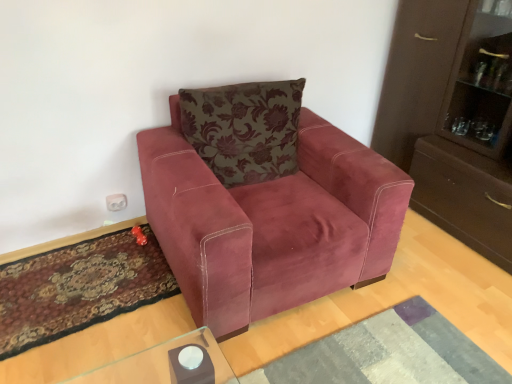
Where is `carpeted rug at lower left, which ranks as the first mat in left-to-right order`? This screenshot has width=512, height=384. carpeted rug at lower left, which ranks as the first mat in left-to-right order is located at coordinates (79, 288).

Where is `chair in front of the velvet floral pillow at center`? Image resolution: width=512 pixels, height=384 pixels. chair in front of the velvet floral pillow at center is located at coordinates (265, 203).

Which object is further away from the camera taking this photo, velvet pink armchair at center or velvet floral pillow at center?

velvet floral pillow at center is more distant.

In terms of width, does velvet pink armchair at center look wider or thinner when compared to velvet floral pillow at center?

velvet pink armchair at center is wider than velvet floral pillow at center.

From a real-world perspective, which object rests below the other?

From a 3D spatial view, velvet pink armchair at center is below.

From the image's perspective, would you say textured gray mat at lower center, which is counted as the first mat, starting from the right, is shown under carpeted rug at lower left, which ranks as the first mat in left-to-right order?

Indeed, from the image's perspective, textured gray mat at lower center, which is counted as the first mat, starting from the right, is shown beneath carpeted rug at lower left, which ranks as the first mat in left-to-right order.

Which object is positioned more to the right, textured gray mat at lower center, which is counted as the first mat, starting from the right, or carpeted rug at lower left, the 2th mat from the right?

Positioned to the right is textured gray mat at lower center, which is counted as the first mat, starting from the right.

Is carpeted rug at lower left, which ranks as the first mat in left-to-right order, at the back of textured gray mat at lower center, which is counted as the first mat, starting from the right?

No, textured gray mat at lower center, which is counted as the first mat, starting from the right, is not facing away from carpeted rug at lower left, which ranks as the first mat in left-to-right order.

Which is in front, point (227, 151) or point (372, 376)?

The point (372, 376) is closer to the camera.

Where is `mat on the right of velvet floral pillow at center`? Image resolution: width=512 pixels, height=384 pixels. mat on the right of velvet floral pillow at center is located at coordinates (388, 353).

Is velvet floral pillow at center facing away from textured gray mat at lower center, placed as the second mat when sorted from left to right?

velvet floral pillow at center does not have its back to textured gray mat at lower center, placed as the second mat when sorted from left to right.

Is point (156, 239) positioned before point (259, 369)?

No, it is behind (259, 369).

From the picture: From the image's perspective, is carpeted rug at lower left, which ranks as the first mat in left-to-right order, below textured gray mat at lower center, which is counted as the first mat, starting from the right?

No, from the image's perspective, carpeted rug at lower left, which ranks as the first mat in left-to-right order, is not beneath textured gray mat at lower center, which is counted as the first mat, starting from the right.

Is carpeted rug at lower left, which ranks as the first mat in left-to-right order, not within textured gray mat at lower center, which is counted as the first mat, starting from the right?

Absolutely, carpeted rug at lower left, which ranks as the first mat in left-to-right order, is external to textured gray mat at lower center, which is counted as the first mat, starting from the right.

Consider the image. Between carpeted rug at lower left, the 2th mat from the right, and textured gray mat at lower center, placed as the second mat when sorted from left to right, which one appears on the right side from the viewer's perspective?

textured gray mat at lower center, placed as the second mat when sorted from left to right.

Is carpeted rug at lower left, which ranks as the first mat in left-to-right order, positioned far away from velvet pink armchair at center?

No, carpeted rug at lower left, which ranks as the first mat in left-to-right order, is not far away from velvet pink armchair at center.

In the scene shown: Considering the relative sizes of carpeted rug at lower left, which ranks as the first mat in left-to-right order, and velvet pink armchair at center in the image provided, is carpeted rug at lower left, which ranks as the first mat in left-to-right order, bigger than velvet pink armchair at center?

Incorrect, carpeted rug at lower left, which ranks as the first mat in left-to-right order, is not larger than velvet pink armchair at center.

Is carpeted rug at lower left, which ranks as the first mat in left-to-right order, in front of or behind velvet pink armchair at center in the image?

carpeted rug at lower left, which ranks as the first mat in left-to-right order, is positioned farther from the viewer than velvet pink armchair at center.

Find the location of a particular element. Image resolution: width=512 pixels, height=384 pixels. mat behind the velvet pink armchair at center is located at coordinates (79, 288).

From a real-world perspective, is velvet pink armchair at center located higher than carpeted rug at lower left, which ranks as the first mat in left-to-right order?

Yes, from a real-world perspective, velvet pink armchair at center is on top of carpeted rug at lower left, which ranks as the first mat in left-to-right order.

Does velvet pink armchair at center lie in front of carpeted rug at lower left, which ranks as the first mat in left-to-right order?

Yes, it is.

From the image's perspective, is velvet pink armchair at center located above or below carpeted rug at lower left, the 2th mat from the right?

Clearly, from the image's perspective, velvet pink armchair at center is above carpeted rug at lower left, the 2th mat from the right.

Considering the points (389, 321) and (277, 125), which point is in front, point (389, 321) or point (277, 125)?

Point (389, 321)

Is textured gray mat at lower center, which is counted as the first mat, starting from the right, in front of or behind velvet floral pillow at center in the image?

textured gray mat at lower center, which is counted as the first mat, starting from the right, is positioned closer to the viewer than velvet floral pillow at center.

From a real-world perspective, which is physically below, textured gray mat at lower center, placed as the second mat when sorted from left to right, or velvet floral pillow at center?

textured gray mat at lower center, placed as the second mat when sorted from left to right.

Consider the image. From the image's perspective, would you say textured gray mat at lower center, which is counted as the first mat, starting from the right, is shown under velvet floral pillow at center?

Yes, from the image's perspective, textured gray mat at lower center, which is counted as the first mat, starting from the right, is below velvet floral pillow at center.

Where is `pillow on the left side of velvet pink armchair at center`? This screenshot has width=512, height=384. pillow on the left side of velvet pink armchair at center is located at coordinates (244, 129).

Find the location of a particular element. This screenshot has height=384, width=512. mat that appears above the textured gray mat at lower center, which is counted as the first mat, starting from the right (from the image's perspective) is located at coordinates (79, 288).

When comparing their distances from velvet floral pillow at center, does velvet pink armchair at center or textured gray mat at lower center, placed as the second mat when sorted from left to right, seem closer?

Among the two, velvet pink armchair at center is located nearer to velvet floral pillow at center.

From the image, which object appears to be nearer to textured gray mat at lower center, which is counted as the first mat, starting from the right, velvet floral pillow at center or velvet pink armchair at center?

velvet pink armchair at center is closer to textured gray mat at lower center, which is counted as the first mat, starting from the right.

When comparing their distances from carpeted rug at lower left, which ranks as the first mat in left-to-right order, does velvet floral pillow at center or velvet pink armchair at center seem closer?

velvet pink armchair at center is closer to carpeted rug at lower left, which ranks as the first mat in left-to-right order.

Looking at the image, which one is located closer to velvet floral pillow at center, textured gray mat at lower center, placed as the second mat when sorted from left to right, or velvet pink armchair at center?

The object closer to velvet floral pillow at center is velvet pink armchair at center.

When comparing their distances from velvet pink armchair at center, does textured gray mat at lower center, placed as the second mat when sorted from left to right, or carpeted rug at lower left, the 2th mat from the right, seem closer?

textured gray mat at lower center, placed as the second mat when sorted from left to right, is positioned closer to the anchor velvet pink armchair at center.

In the scene shown: From the image, which object appears to be nearer to textured gray mat at lower center, placed as the second mat when sorted from left to right, velvet floral pillow at center or carpeted rug at lower left, which ranks as the first mat in left-to-right order?

carpeted rug at lower left, which ranks as the first mat in left-to-right order.

Based on their spatial positions, is textured gray mat at lower center, placed as the second mat when sorted from left to right, or velvet pink armchair at center closer to carpeted rug at lower left, the 2th mat from the right?

velvet pink armchair at center is closer to carpeted rug at lower left, the 2th mat from the right.

When comparing their distances from textured gray mat at lower center, placed as the second mat when sorted from left to right, does carpeted rug at lower left, the 2th mat from the right, or velvet floral pillow at center seem further?

Among the two, velvet floral pillow at center is located further to textured gray mat at lower center, placed as the second mat when sorted from left to right.

This screenshot has width=512, height=384. Find the location of `pillow between carpeted rug at lower left, which ranks as the first mat in left-to-right order, and velvet pink armchair at center, in the horizontal direction`. pillow between carpeted rug at lower left, which ranks as the first mat in left-to-right order, and velvet pink armchair at center, in the horizontal direction is located at coordinates (244, 129).

This screenshot has height=384, width=512. Identify the location of pillow located between carpeted rug at lower left, the 2th mat from the right, and textured gray mat at lower center, placed as the second mat when sorted from left to right, in the left-right direction. (244, 129).

You are a GUI agent. You are given a task and a screenshot of the screen. Output one action in this format:
    pyautogui.click(x=<x>, y=<y>)
    Task: Click on the chair situated between carpeted rug at lower left, the 2th mat from the right, and textured gray mat at lower center, which is counted as the first mat, starting from the right, from left to right
    
    Given the screenshot: What is the action you would take?
    pyautogui.click(x=265, y=203)

Where is `chair that lies between velvet floral pillow at center and textured gray mat at lower center, placed as the second mat when sorted from left to right, from top to bottom`? chair that lies between velvet floral pillow at center and textured gray mat at lower center, placed as the second mat when sorted from left to right, from top to bottom is located at coordinates (265, 203).